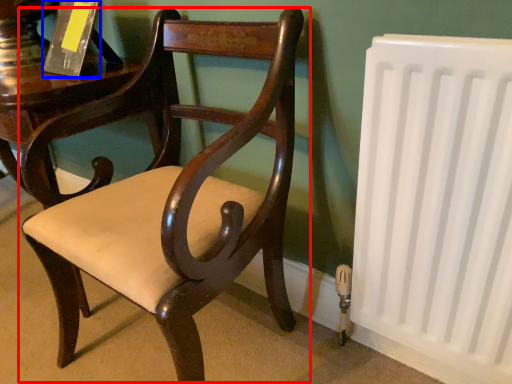
Question: Which point is closer to the camera, chair (highlighted by a red box) or paperback book (highlighted by a blue box)?

Choices:
 (A) chair
 (B) paperback book

Answer: (A)